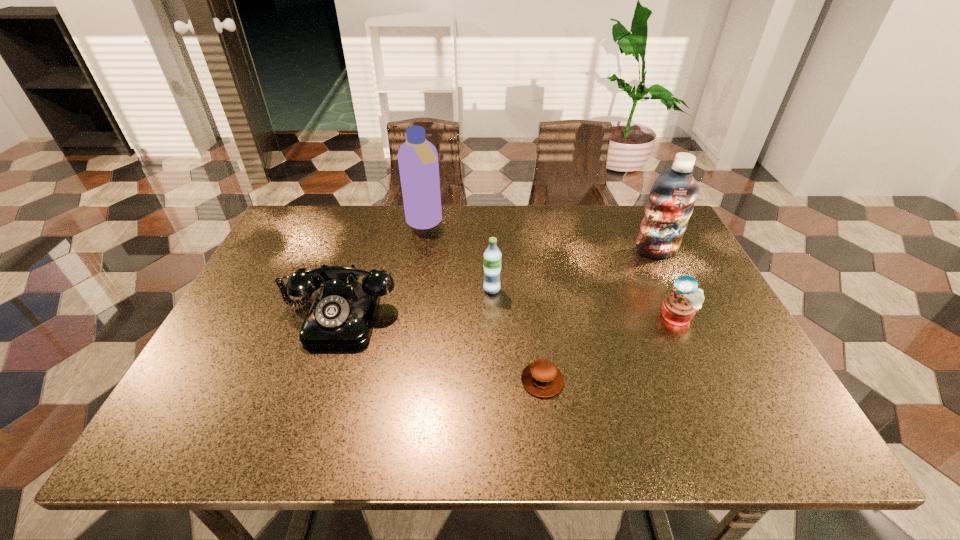
Where is `the third object from right to left`? The image size is (960, 540). the third object from right to left is located at coordinates (542, 378).

Find the location of a particular element. blank space located on the right of the farthest object is located at coordinates (545, 223).

Find the location of a particular element. vacant space situated 0.110m on the front label of the nearer shampoo is located at coordinates (672, 286).

The width and height of the screenshot is (960, 540). Identify the location of vacant region located 0.330m on the right of the third tallest object. (626, 289).

Locate an element on the screen. vacant space situated on the dial of the telephone is located at coordinates (322, 368).

This screenshot has height=540, width=960. Identify the location of free space located on the front-facing side of the farther muffin. (728, 423).

Locate an element on the screen. The height and width of the screenshot is (540, 960). vacant space located 0.060m on the left of the fourth object from left to right is located at coordinates (493, 380).

This screenshot has height=540, width=960. I want to click on object located in the left edge section of the desktop, so (x=341, y=316).

This screenshot has width=960, height=540. Identify the location of shampoo situated at the right edge. (671, 201).

Identify the location of muffin that is at the right edge. This screenshot has height=540, width=960. (679, 307).